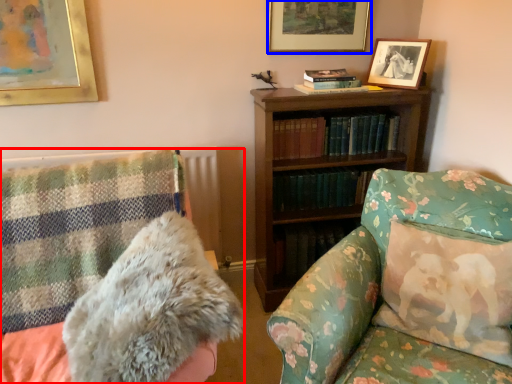
Question: Which object is further to the camera taking this photo, furniture (highlighted by a red box) or picture frame (highlighted by a blue box)?

Choices:
 (A) furniture
 (B) picture frame

Answer: (B)